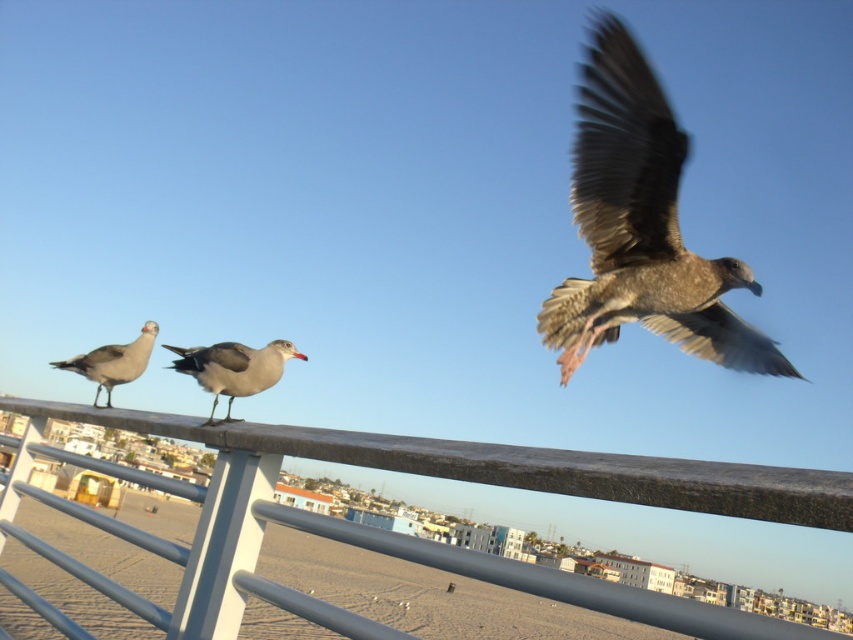
You are a birdwatcher standing on the pier. You see the brown feathered bird at upper right and the gray matte seagull at left. If you want to observe both birds clearly, which one is closer to you?

The gray matte seagull at left is closer to you than the brown feathered bird at upper right, so you can observe it more clearly.

In the scene shown: You are standing at the point with coordinates point (90, 369) and want to walk towards the point with coordinates point (718, 499). Which direction should you face to walk directly towards your destination?

You should face towards the direction of point (718, 499), which is in front of point (90, 369), so you need to walk forward in that direction.

From the picture: You are a birdwatcher observing the two birds in the image. Which bird is bigger between the brown feathered bird at upper right and the gray matte seagull at left?

The brown feathered bird at upper right is larger than the gray matte seagull at left according to the description.